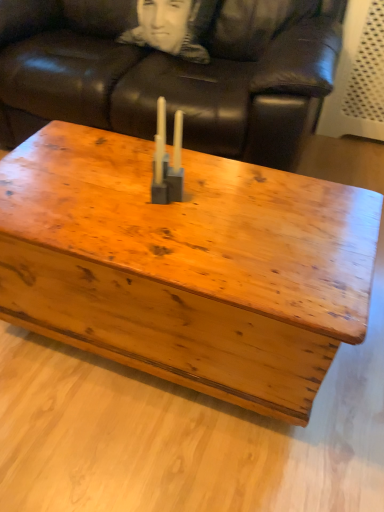
Where is `vacant space in front of wooden coffee table at center`? vacant space in front of wooden coffee table at center is located at coordinates (152, 447).